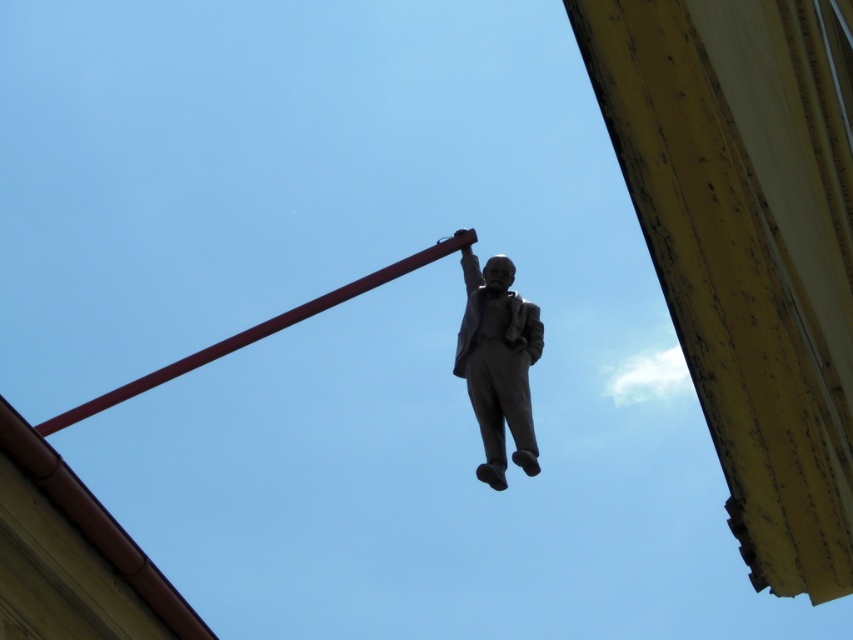
Is the position of bronze statue at center more distant than that of smooth red pole at center?

That is False.

Which is above, bronze statue at center or smooth red pole at center?

bronze statue at center is above.

Which is in front, point (535, 458) or point (218, 344)?

Point (535, 458) is more forward.

What are the coordinates of `bronze statue at center` in the screenshot? It's located at (498, 364).